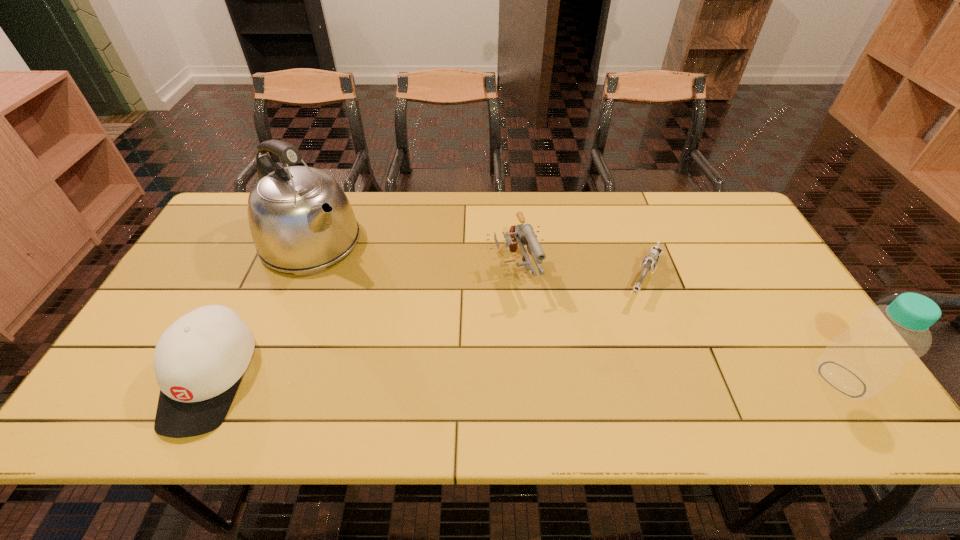
You are a GUI agent. You are given a task and a screenshot of the screen. Output one action in this format:
    pyautogui.click(x=<x>, y=<y>)
    Task: Click on the empty space between the bottle and the second shortest object
    
    Given the screenshot: What is the action you would take?
    pyautogui.click(x=526, y=379)

In order to click on object that is the third closest to the taller gun in this screenshot , I will do `click(199, 361)`.

Image resolution: width=960 pixels, height=540 pixels. Identify the location of object that is the second closest one to the baseball cap. 521,234.

This screenshot has height=540, width=960. Identify the location of free location that satisfies the following two spatial constraints: 1. on the front side of the kettle; 2. on the right side of the left gun. (300, 271).